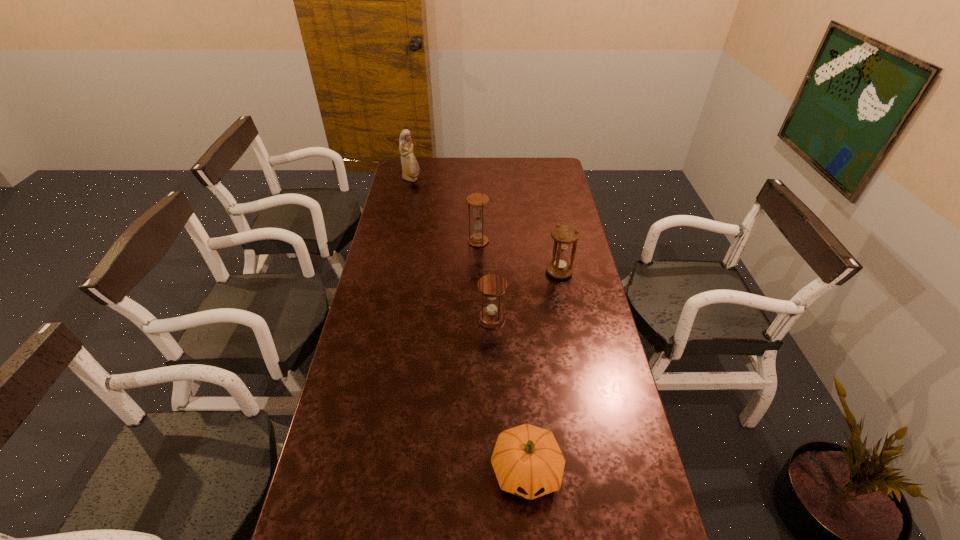
Locate an element on the screen. This screenshot has height=540, width=960. vacant position located on the front of the second farthest hourglass is located at coordinates (564, 296).

In order to click on vacant point located 0.190m on the left of the shortest hourglass in this screenshot , I will do `click(422, 319)`.

Where is `vacant area situated on the side of the nearest object with the carved face`? This screenshot has width=960, height=540. vacant area situated on the side of the nearest object with the carved face is located at coordinates (531, 532).

Find the location of a particular element. This screenshot has width=960, height=540. object that is at the far edge is located at coordinates pos(410,169).

Locate an element on the screen. The height and width of the screenshot is (540, 960). object at the left edge is located at coordinates (410, 169).

Find the location of a particular element. This screenshot has width=960, height=540. object that is positioned at the right edge is located at coordinates (564, 235).

Find the location of `object that is at the far left corner`. object that is at the far left corner is located at coordinates (410, 169).

Where is `free space at the far edge`? The width and height of the screenshot is (960, 540). free space at the far edge is located at coordinates (524, 171).

This screenshot has height=540, width=960. Find the location of `vacant space at the left edge of the desktop`. vacant space at the left edge of the desktop is located at coordinates (394, 199).

The image size is (960, 540). Identify the location of free space at the right edge of the desktop. tap(588, 280).